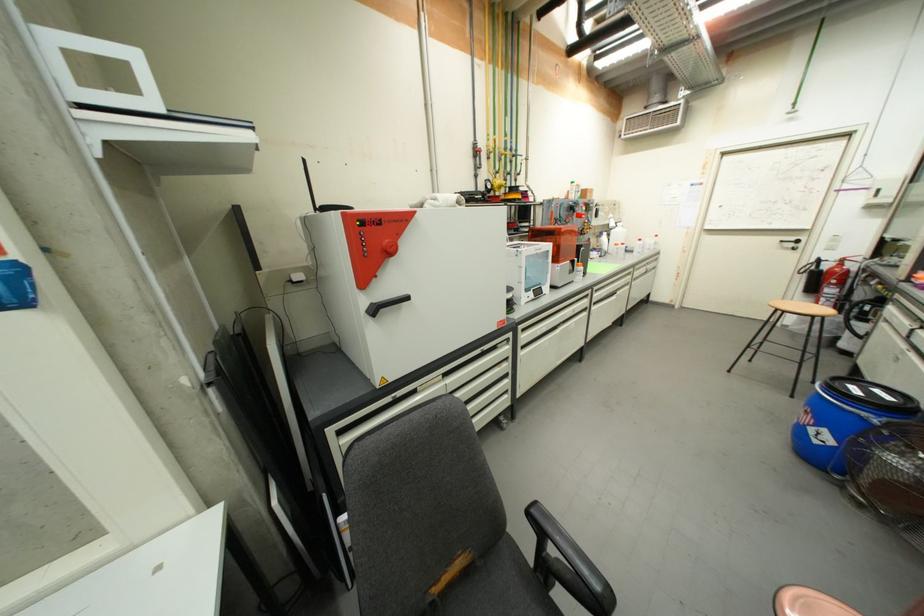
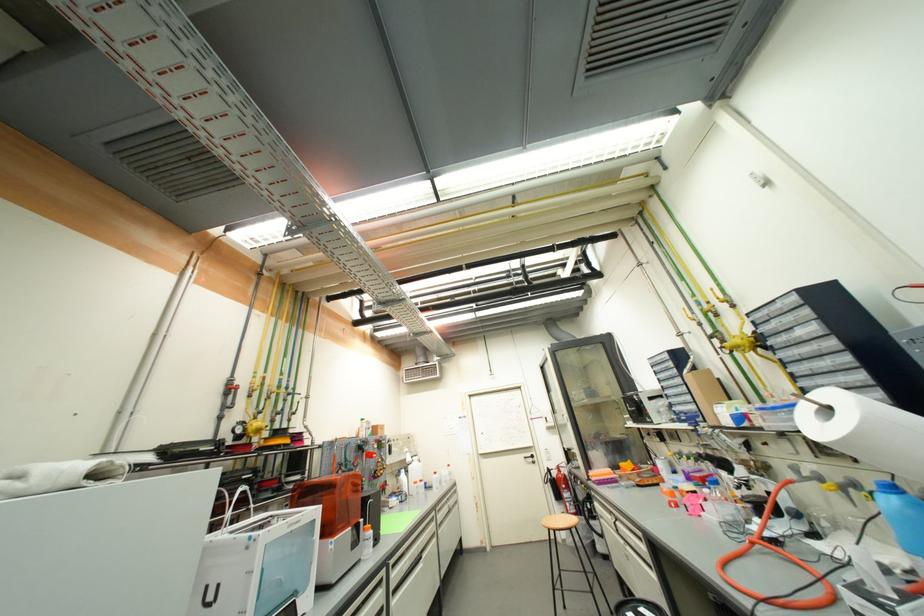
How did the camera likely rotate?

The camera's rotation is toward right-up.